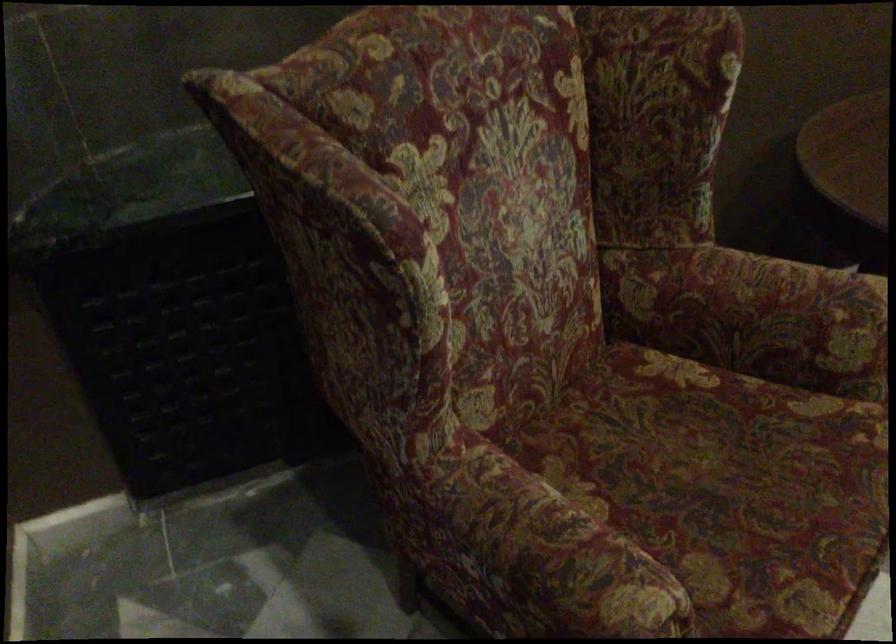
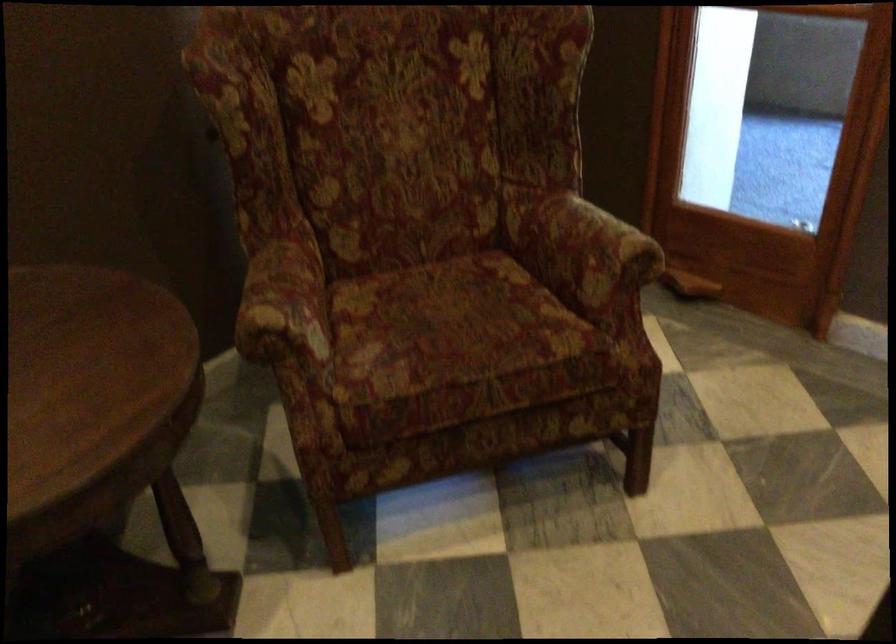
Question: What movement of the cameraman would produce the second image?

Choices:
 (A) Left
 (B) Right
 (C) Forward
 (D) Backward

Answer: (B)